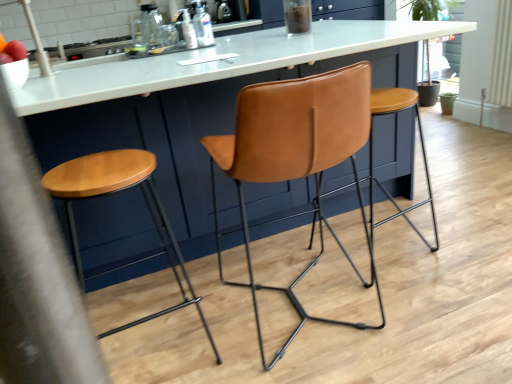
Identify the location of vacant space situated on the left part of leather stool at center, the 1th stool in the right-to-left sequence. This screenshot has width=512, height=384. (292, 242).